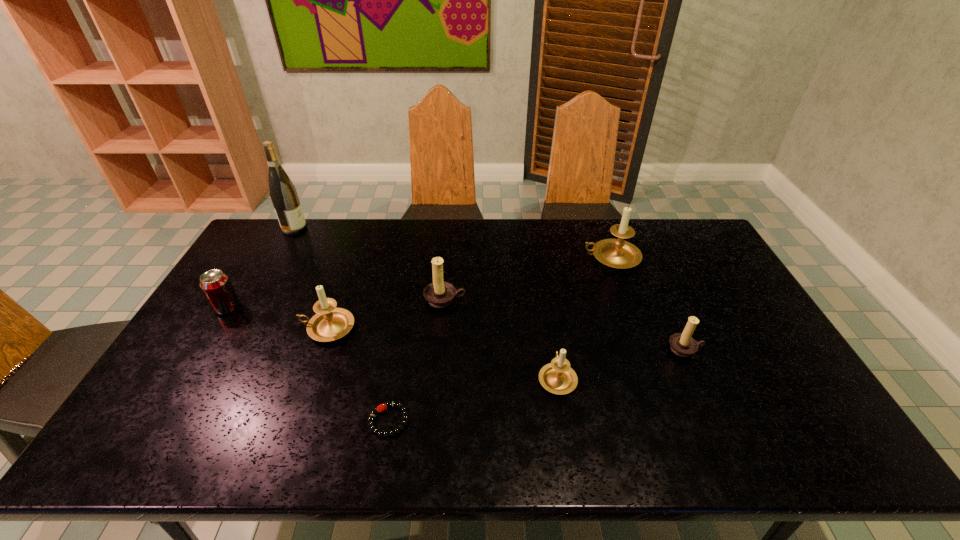
The height and width of the screenshot is (540, 960). In order to click on wine bottle in this screenshot , I will do `click(283, 194)`.

This screenshot has width=960, height=540. I want to click on the tallest object, so click(x=283, y=194).

Find the location of a particular element. This screenshot has width=960, height=540. the seventh shortest object is located at coordinates (617, 253).

This screenshot has height=540, width=960. What are the coordinates of `the biggest beige candle holder` in the screenshot? It's located at (617, 253).

You are a GUI agent. You are given a task and a screenshot of the screen. Output one action in this format:
    pyautogui.click(x=<x>, y=<y>)
    Task: Click on the leftmost beige candle holder
    This screenshot has width=960, height=540.
    Given the screenshot: What is the action you would take?
    point(330,323)

At what (x,y) coordinates should I click in order to perform the action: click on the leftmost candle holder. Please return your answer as a coordinate pair (x, y). Looking at the image, I should click on (330, 323).

The width and height of the screenshot is (960, 540). I want to click on the farther brown candle holder, so click(439, 294).

The height and width of the screenshot is (540, 960). Identify the location of the fourth nearest candle holder. (439, 294).

I want to click on soda can, so click(x=216, y=286).

You are a GUI agent. You are given a task and a screenshot of the screen. Output one action in this format:
    pyautogui.click(x=<x>, y=<y>)
    Task: Click on the nearest candle holder
    
    Given the screenshot: What is the action you would take?
    pyautogui.click(x=557, y=377)